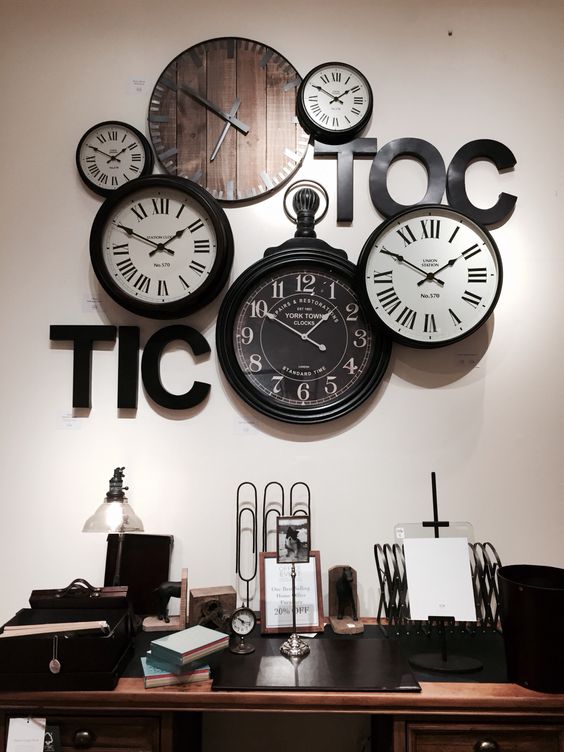
The image size is (564, 752). Identify the location of clocks. (110, 144), (232, 120), (351, 99), (417, 256), (289, 314), (160, 259).